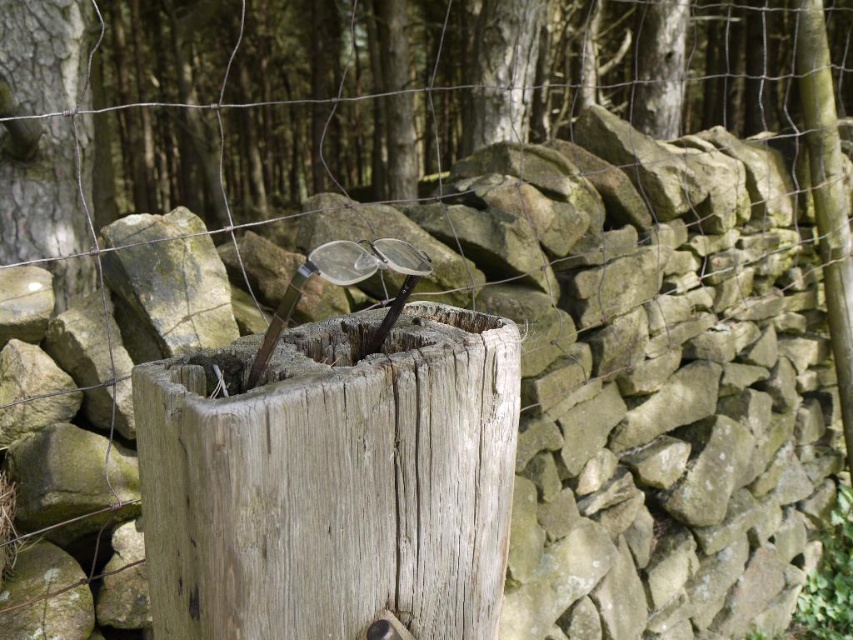
Question: Is weathered wood at center positioned in front of smooth bark tree trunk at center?

Choices:
 (A) no
 (B) yes

Answer: (B)

Question: Is weathered wood at center thinner than smooth bark tree trunk at center?

Choices:
 (A) no
 (B) yes

Answer: (A)

Question: Which object is closer to the camera taking this photo?

Choices:
 (A) weathered wood at center
 (B) smooth bark tree trunk at center

Answer: (A)

Question: Is weathered wood at center positioned in front of smooth bark tree trunk at center?

Choices:
 (A) no
 (B) yes

Answer: (B)

Question: Which point is farther to the camera?

Choices:
 (A) tap(6, 83)
 (B) tap(277, 577)

Answer: (A)

Question: Which of the following is the farthest from the observer?

Choices:
 (A) (488, 472)
 (B) (28, 205)

Answer: (B)